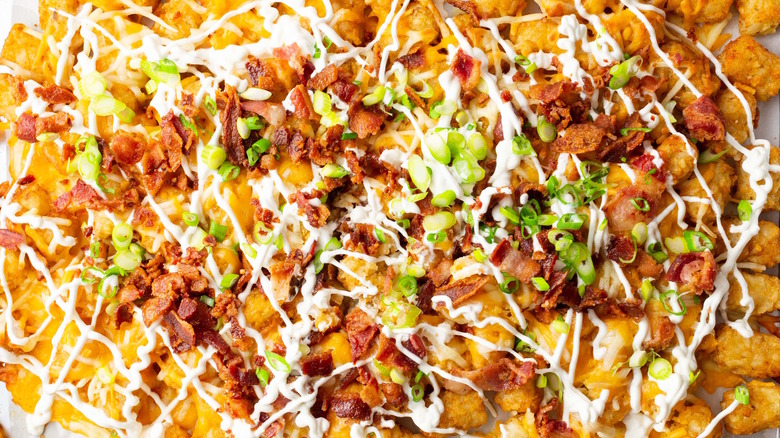
What are the coordinates of `table` in the screenshot? It's located at (0, 433).